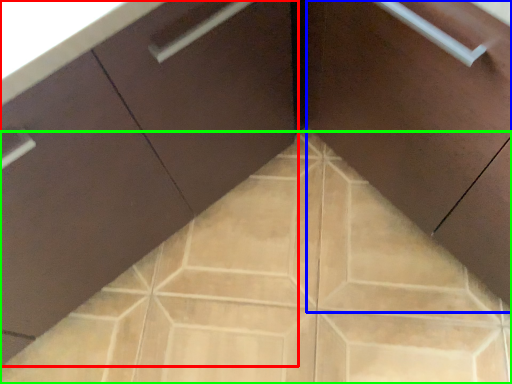
Question: Based on their relative distances, which object is farther from cabinetry (highlighted by a red box)? Choose from cabinetry (highlighted by a blue box) and ceramic tile (highlighted by a green box).

Choices:
 (A) cabinetry
 (B) ceramic tile

Answer: (A)